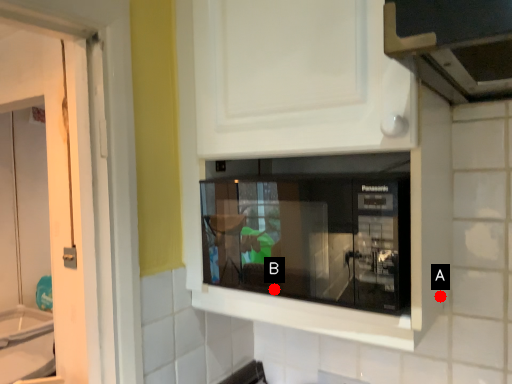
Question: Two points are circled on the image, labeled by A and B beside each circle. Among these points, which one is farthest from the camera?

Choices:
 (A) A is further
 (B) B is further

Answer: (A)